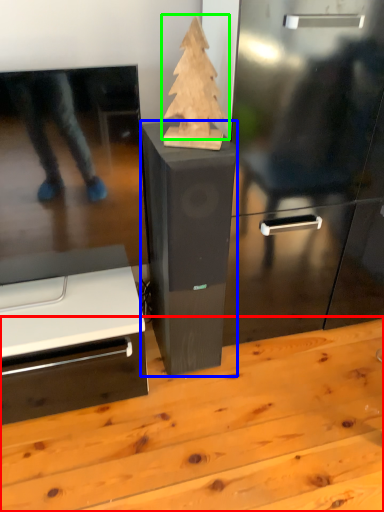
Question: Considering the real-world distances, which object is closest to table (highlighted by a red box)? furniture (highlighted by a blue box) or christmas tree (highlighted by a green box).

Choices:
 (A) furniture
 (B) christmas tree

Answer: (A)